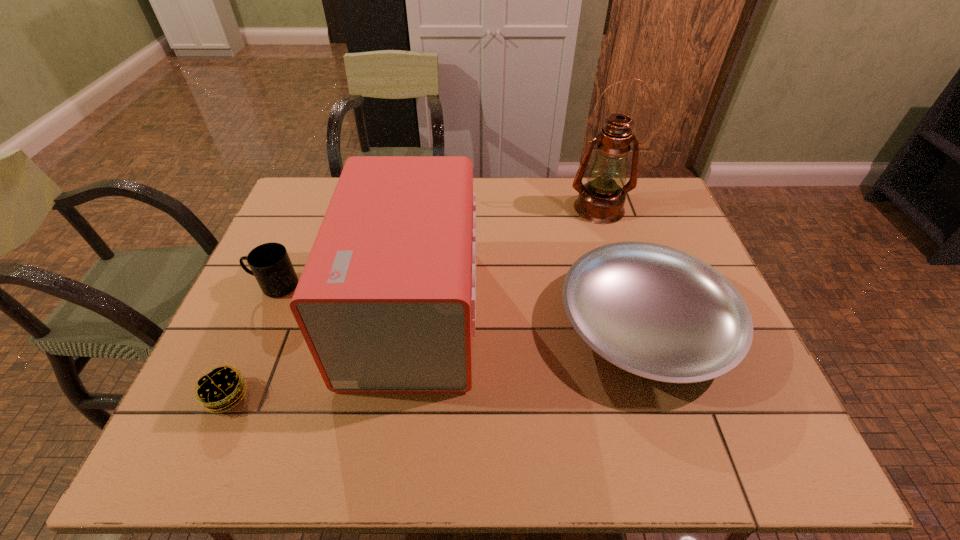
Identify the location of free space located 0.090m on the right of the patty. (289, 395).

At what (x,y) coordinates should I click in order to perform the action: click on object situated at the far edge. Please return your answer as a coordinate pair (x, y). Looking at the image, I should click on (601, 200).

You are a GUI agent. You are given a task and a screenshot of the screen. Output one action in this format:
    pyautogui.click(x=<x>, y=<y>)
    Task: Click on the mug that is at the left edge
    This screenshot has height=540, width=960.
    Given the screenshot: What is the action you would take?
    pyautogui.click(x=270, y=263)

You are a GUI agent. You are given a task and a screenshot of the screen. Output one action in this format:
    pyautogui.click(x=<x>, y=<y>)
    Task: Click on the patty at the left edge
    The height and width of the screenshot is (540, 960).
    Given the screenshot: What is the action you would take?
    pyautogui.click(x=215, y=389)

You are a GUI agent. You are given a task and a screenshot of the screen. Output one action in this format:
    pyautogui.click(x=<x>, y=<y>)
    Task: Click on the oil lamp located in the right edge section of the desktop
    The width and height of the screenshot is (960, 540).
    Given the screenshot: What is the action you would take?
    pyautogui.click(x=601, y=200)

Identify the location of bedpan that is at the right edge. The height and width of the screenshot is (540, 960). (655, 311).

At what (x,y) coordinates should I click in order to perform the action: click on object located at the far right corner. Please return your answer as a coordinate pair (x, y). Looking at the image, I should click on click(x=601, y=200).

At what (x,y) coordinates should I click in order to perform the action: click on vacant region at the far edge of the desktop. Please return your answer as a coordinate pair (x, y). This screenshot has width=960, height=540. Looking at the image, I should click on (564, 197).

Find the location of a particular element. free location at the near edge of the desktop is located at coordinates (x=340, y=434).

I want to click on free location at the left edge, so click(x=300, y=224).